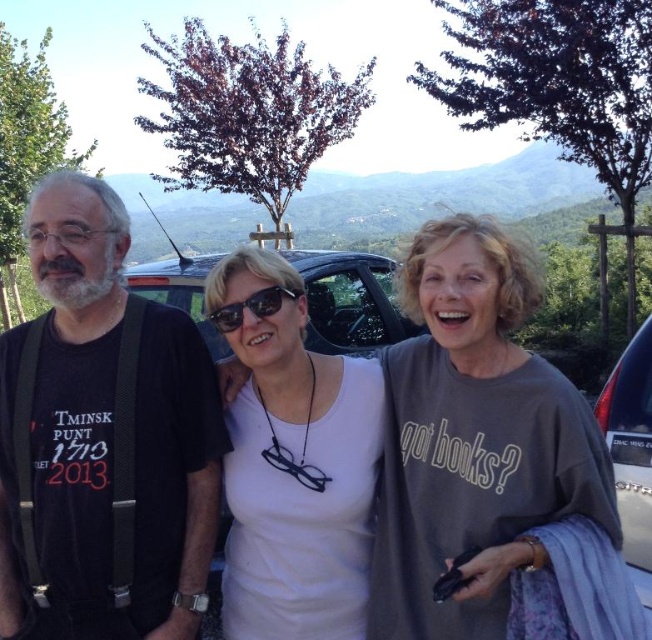
Question: From the image, what is the correct spatial relationship of white matte shirt at center in relation to silver metallic car at right?

Choices:
 (A) below
 (B) above

Answer: (B)

Question: Which point is closer to the camera taking this photo?

Choices:
 (A) (246, 440)
 (B) (640, 438)
 (C) (106, 305)
 (D) (230, 310)

Answer: (C)

Question: Which of the following is the farthest from the observer?

Choices:
 (A) white matte shirt at center
 (B) silver metallic car at right
 (C) white matte tank top at center
 (D) black matte t-shirt at left

Answer: (B)

Question: In this image, where is white matte shirt at center located relative to sunglasses at center?

Choices:
 (A) left
 (B) right

Answer: (B)

Question: Does white matte shirt at center appear under sunglasses at center?

Choices:
 (A) no
 (B) yes

Answer: (B)

Question: Considering the real-world distances, which object is closest to the sunglasses at center?

Choices:
 (A) white matte tank top at center
 (B) black matte t-shirt at left
 (C) white matte shirt at center

Answer: (A)